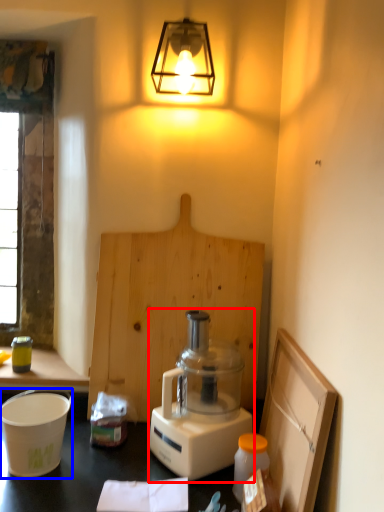
Question: Among these objects, which one is nearest to the camera, blender (highlighted by a red box) or appliance (highlighted by a blue box)?

Choices:
 (A) blender
 (B) appliance

Answer: (A)